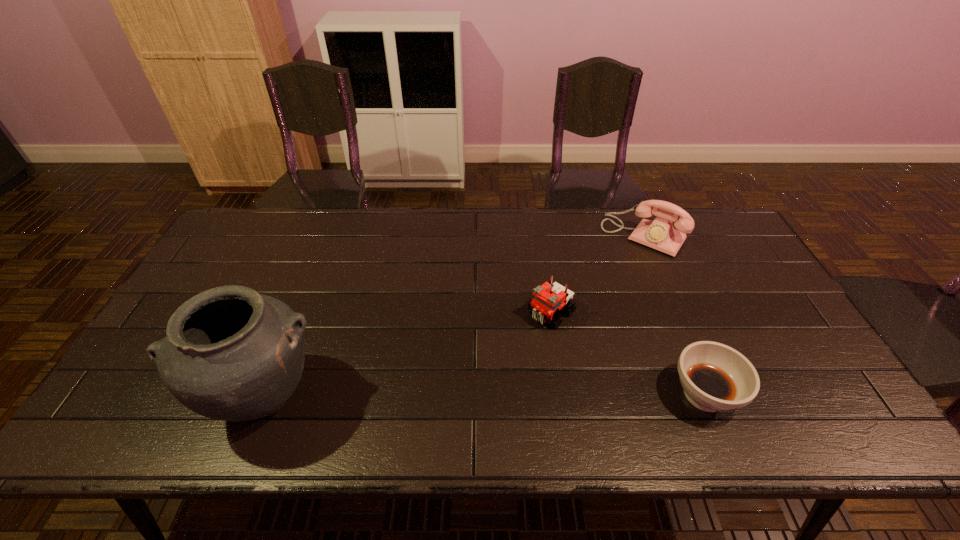
Image resolution: width=960 pixels, height=540 pixels. In order to click on free space between the second object from left to right and the leftmost object in this screenshot , I will do `click(408, 355)`.

At what (x,y) coordinates should I click in order to perform the action: click on free spot between the tallest object and the soup bowl. Please return your answer as a coordinate pair (x, y). The width and height of the screenshot is (960, 540). Looking at the image, I should click on (485, 396).

At what (x,y) coordinates should I click in order to perform the action: click on free space between the shortest object and the tallest object. Please return your answer as a coordinate pair (x, y). The width and height of the screenshot is (960, 540). Looking at the image, I should click on (485, 396).

You are a GUI agent. You are given a task and a screenshot of the screen. Output one action in this format:
    pyautogui.click(x=<x>, y=<y>)
    Task: Click on the object that is the third closest one to the third shortest object
    
    Given the screenshot: What is the action you would take?
    pos(231,354)

Locate an element on the screen. The width and height of the screenshot is (960, 540). the closest object to the leftmost object is located at coordinates (548, 298).

What are the coordinates of `free spot that satisfies the following two spatial constraints: 1. on the front side of the soup bowl; 2. on the right side of the Lego` in the screenshot? It's located at (564, 395).